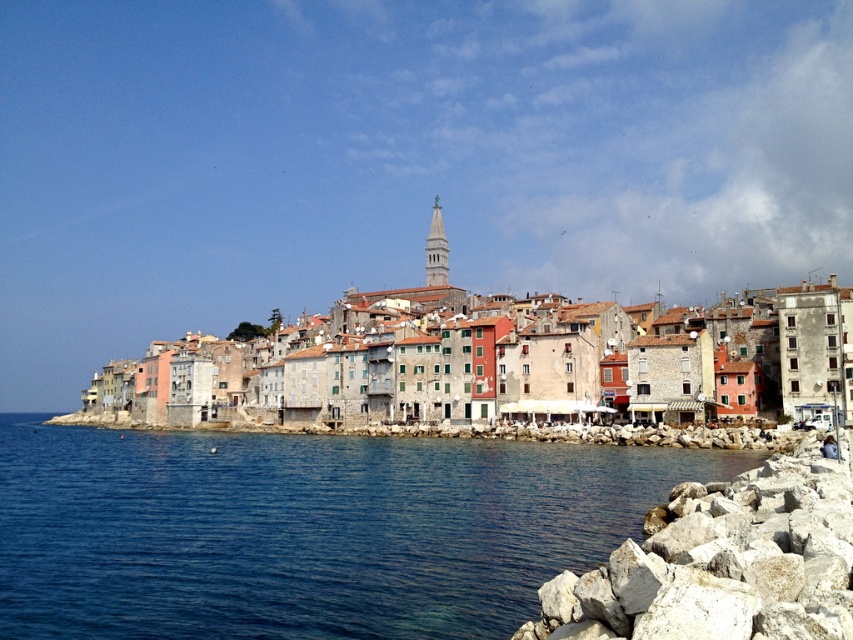
Is blue water at lower left closer to camera compared to multicolored stone buildings at center?

Yes.

Who is positioned more to the right, blue water at lower left or multicolored stone buildings at center?

multicolored stone buildings at center is more to the right.

Describe the element at coordinates (306, 529) in the screenshot. The image size is (853, 640). I see `blue water at lower left` at that location.

Where is `blue water at lower left`? The width and height of the screenshot is (853, 640). blue water at lower left is located at coordinates (306, 529).

Image resolution: width=853 pixels, height=640 pixels. What do you see at coordinates (306, 529) in the screenshot? I see `blue water at lower left` at bounding box center [306, 529].

In the scene shown: Does blue water at lower left have a larger size compared to white rough rock at lower right?

Yes.

Is point (410, 444) closer to viewer compared to point (839, 538)?

No, (410, 444) is further to viewer.

At what (x,y) coordinates should I click in order to perform the action: click on blue water at lower left. Please return your answer as a coordinate pair (x, y). Image resolution: width=853 pixels, height=640 pixels. Looking at the image, I should click on (306, 529).

Describe the element at coordinates (724, 564) in the screenshot. The height and width of the screenshot is (640, 853). I see `white rough rock at lower right` at that location.

Which is in front, point (843, 528) or point (817, 381)?

Point (843, 528) is in front.

Where is `white rough rock at lower right`? The image size is (853, 640). white rough rock at lower right is located at coordinates (724, 564).